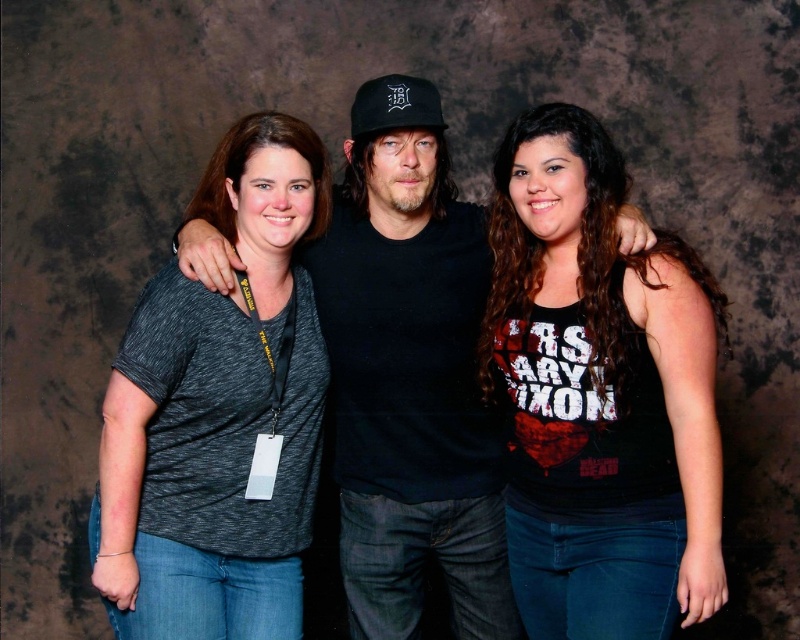
Is point (169, 356) less distant than point (409, 115)?

Yes, point (169, 356) is closer to viewer.

Who is more distant from viewer, (224, 481) or (384, 76)?

Point (384, 76)

This screenshot has width=800, height=640. In order to click on dark gray heathered t-shirt at left in this screenshot , I will do `click(218, 413)`.

Is point (650, 312) positioned after point (378, 412)?

No, it is not.

Describe the element at coordinates (600, 394) in the screenshot. I see `black tank top at center` at that location.

Is point (708, 524) positioned before point (402, 280)?

Yes, point (708, 524) is in front of point (402, 280).

The image size is (800, 640). Identify the location of black tank top at center. (600, 394).

Is the position of black tank top at center more distant than that of dark gray heathered t-shirt at left?

No, black tank top at center is in front of dark gray heathered t-shirt at left.

This screenshot has width=800, height=640. Describe the element at coordinates (600, 394) in the screenshot. I see `black tank top at center` at that location.

You are a GUI agent. You are given a task and a screenshot of the screen. Output one action in this format:
    pyautogui.click(x=<x>, y=<y>)
    Task: Click on the black tank top at center
    
    Given the screenshot: What is the action you would take?
    pyautogui.click(x=600, y=394)